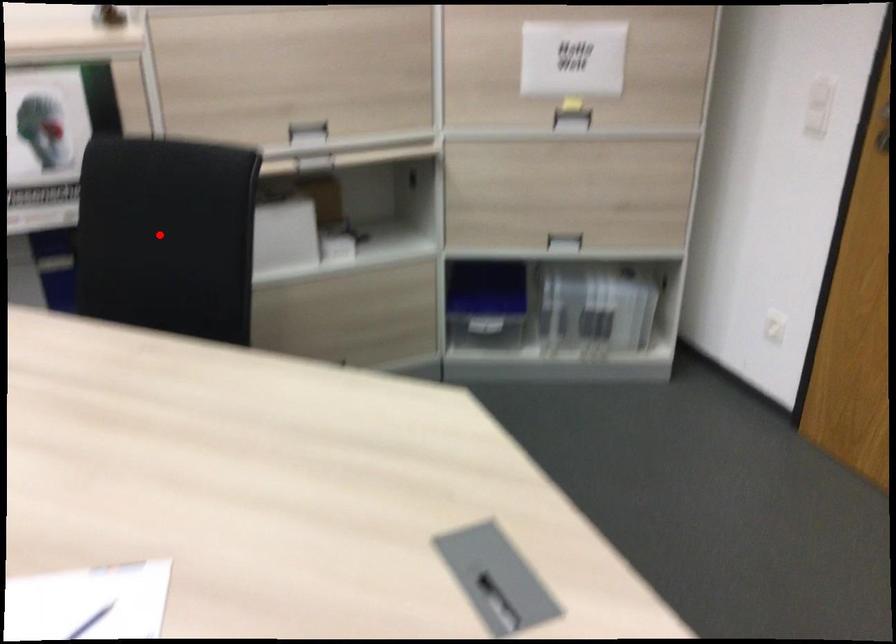
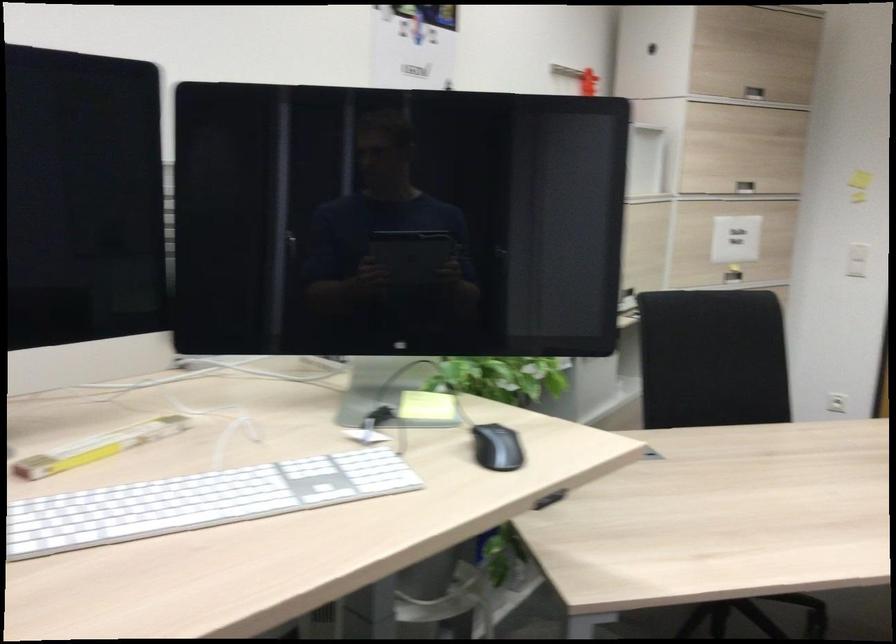
Where in the second image is the point corresponding to the highlighted location from the first image?

(712, 359)